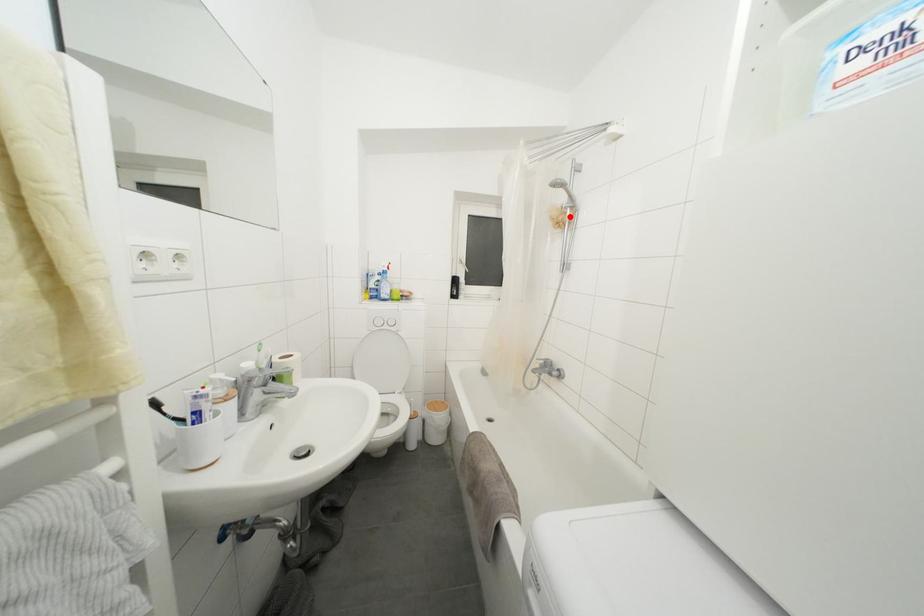
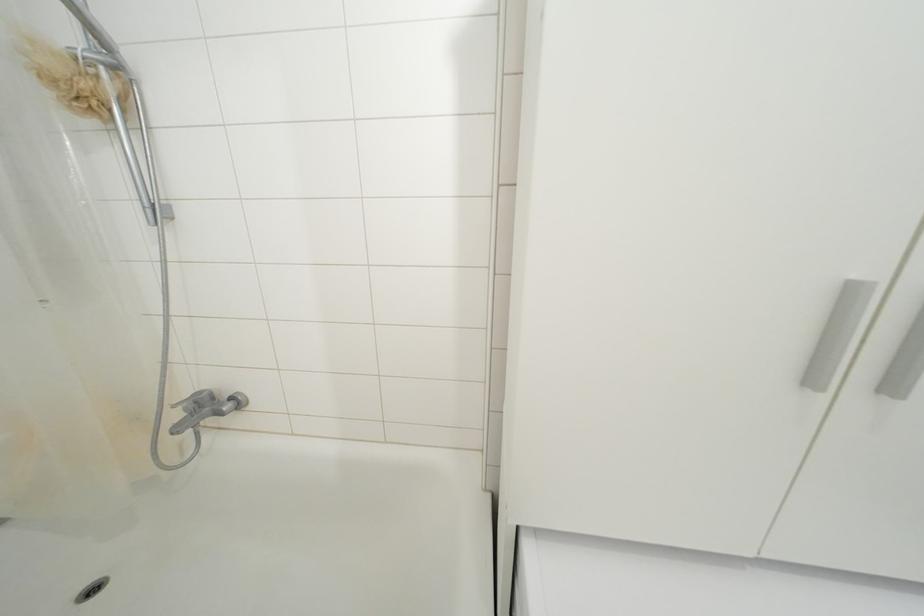
Find the pixel in the second image that matches the highlighted location in the first image.

(100, 79)